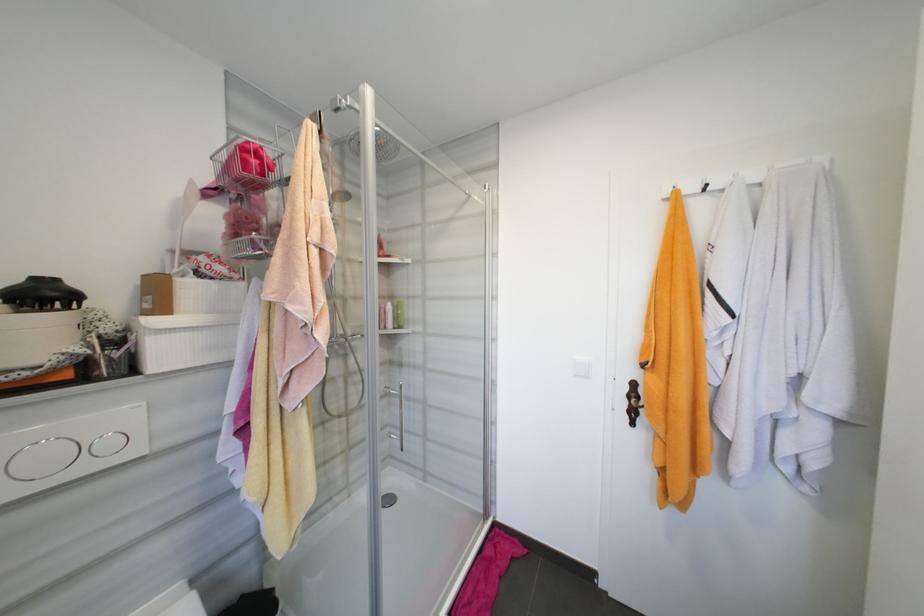
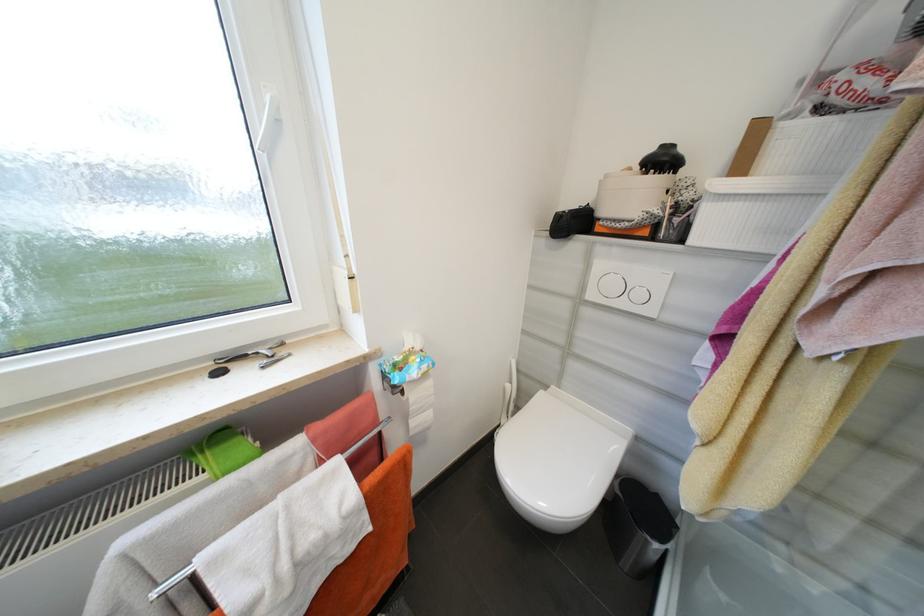
Where in the second image is the point corresponding to point 115,445 from the first image?

(646, 296)